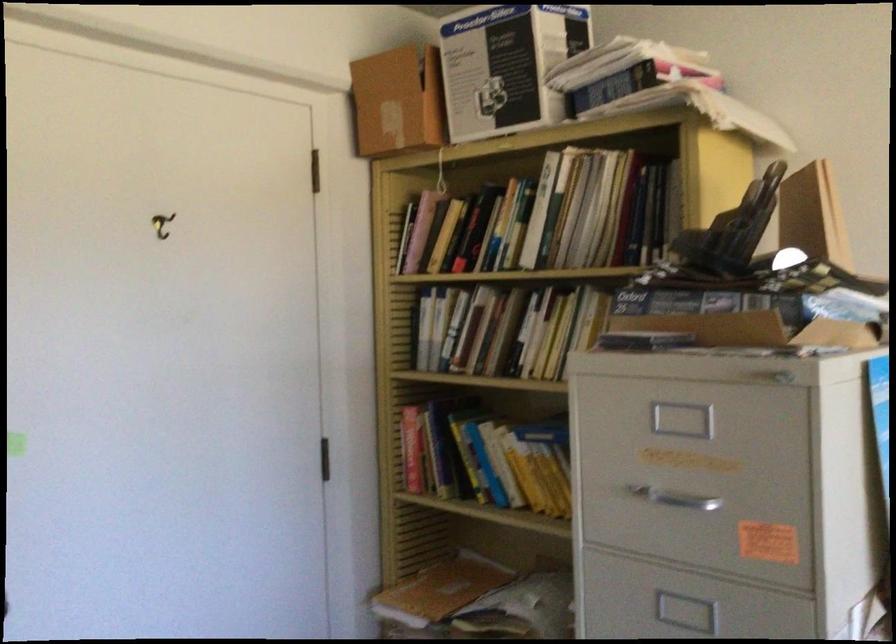
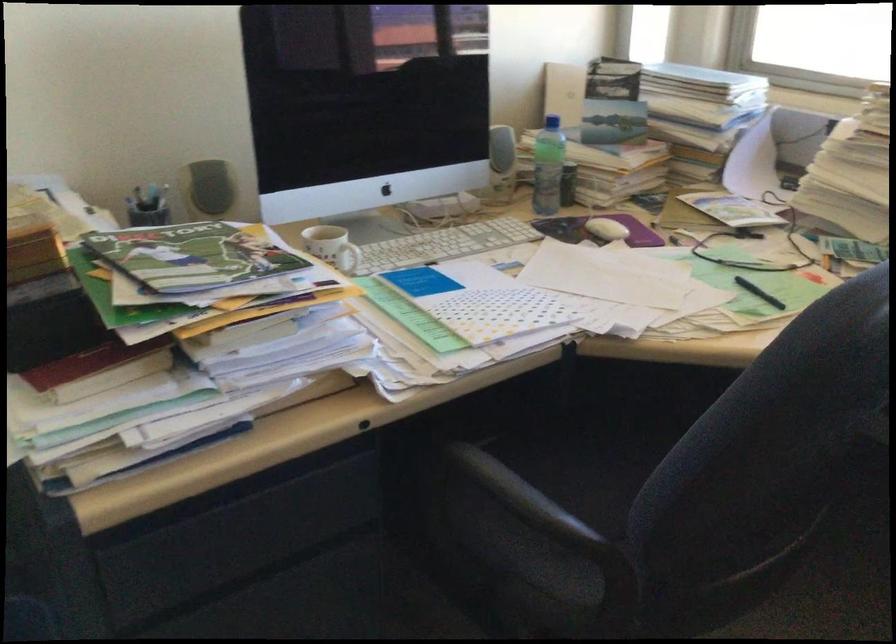
First-person continuous shooting, in which direction is the camera rotating?

The rotation direction of the camera is right-down.